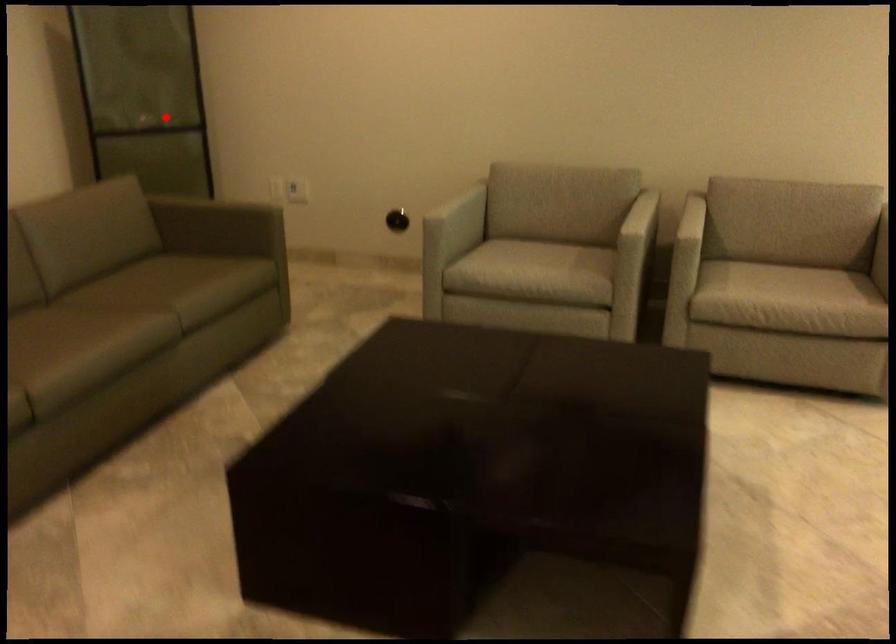
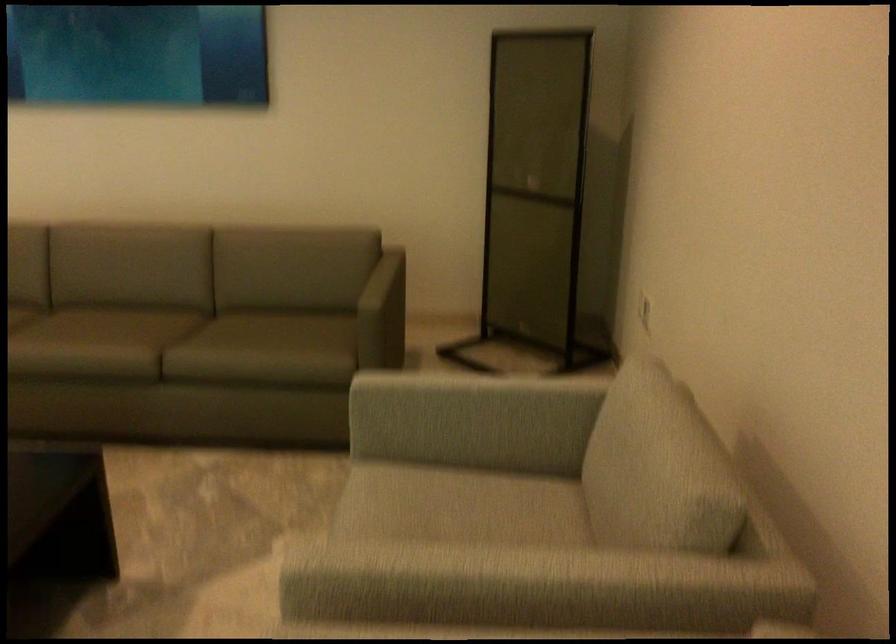
In the second image, find the point that corresponds to the highlighted location in the first image.

(536, 194)